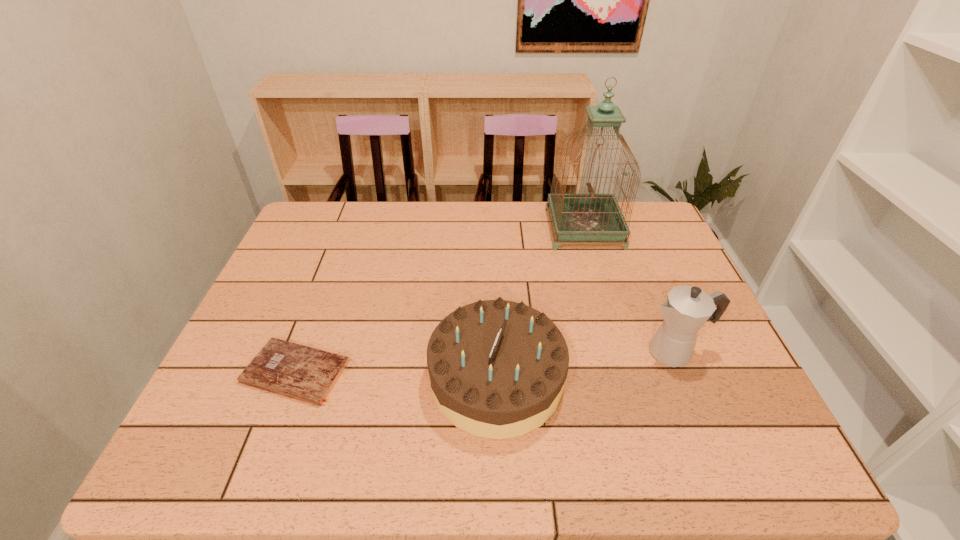
The width and height of the screenshot is (960, 540). Identify the location of birdcage. (576, 217).

This screenshot has height=540, width=960. Identify the location of the farthest object. (576, 217).

Find the location of a particular element. This screenshot has height=540, width=960. coffeepot is located at coordinates (686, 310).

Locate an element on the screen. the second shortest object is located at coordinates (497, 368).

Where is `the third object from right to left`? the third object from right to left is located at coordinates (497, 368).

Locate an element on the screen. The image size is (960, 540). the shortest object is located at coordinates (292, 370).

Image resolution: width=960 pixels, height=540 pixels. Find the location of `the leftmost object`. the leftmost object is located at coordinates [x=292, y=370].

Find the location of `vacant region located 0.130m at the door of the farthest object`. vacant region located 0.130m at the door of the farthest object is located at coordinates (509, 229).

Identify the location of vacant space located at the door of the farthest object. (530, 229).

Locate an element on the screen. This screenshot has width=960, height=540. vacant space located 0.090m at the door of the farthest object is located at coordinates (521, 229).